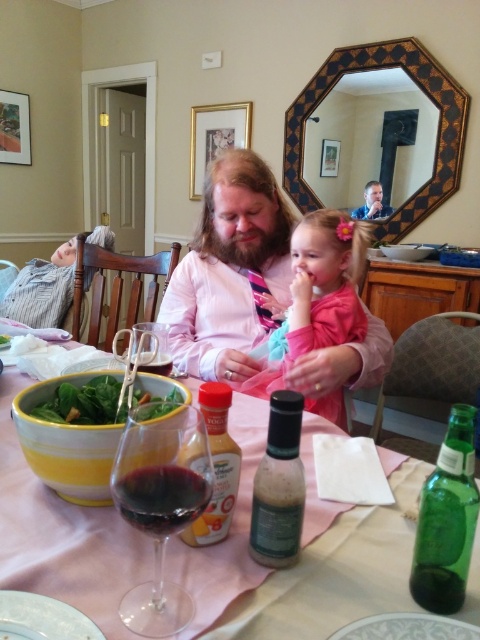
Question: Can you confirm if transparent glass wine glass at center is positioned below translucent plastic bottle at center?

Choices:
 (A) yes
 (B) no

Answer: (A)

Question: Can you confirm if green glass bottle at center is smaller than striped knit sweater at left?

Choices:
 (A) no
 (B) yes

Answer: (B)

Question: Which of the following is the closest to the observer?

Choices:
 (A) green glass bottle at lower right
 (B) translucent plastic bottle at center
 (C) green leafy salad at lower left

Answer: (A)

Question: Is green leafy salad at lower left above smooth skin face at upper center?

Choices:
 (A) no
 (B) yes

Answer: (A)

Question: Which of the following is the closest to the observer?

Choices:
 (A) (176, 401)
 (B) (48, 296)
 (C) (154, 508)

Answer: (C)

Question: Which of the following is the closest to the observer?

Choices:
 (A) (200, 538)
 (B) (290, 355)

Answer: (A)